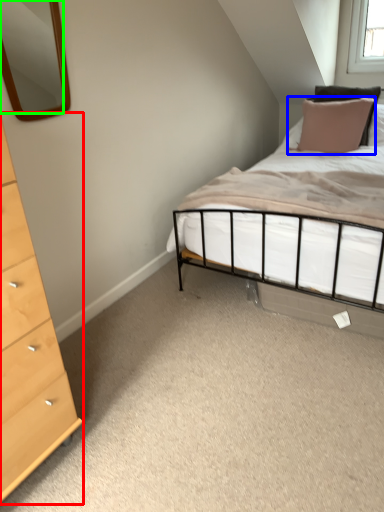
Question: Which object is the closest to the chest of drawers (highlighted by a red box)? Choose among these: pillow (highlighted by a blue box) or mirror (highlighted by a green box).

Choices:
 (A) pillow
 (B) mirror

Answer: (A)